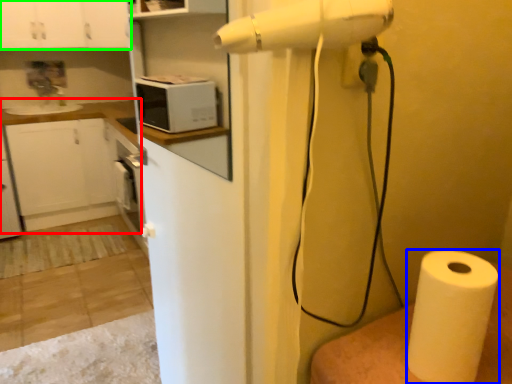
Question: Which is farther away from counter top (highlighted by a red box)? paper towel (highlighted by a blue box) or cabinetry (highlighted by a green box)?

Choices:
 (A) paper towel
 (B) cabinetry

Answer: (A)